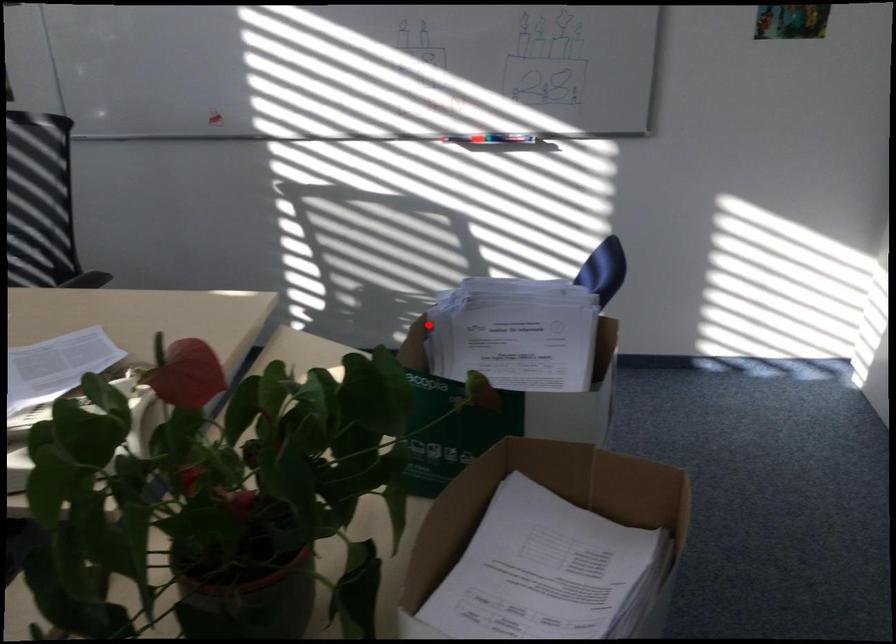
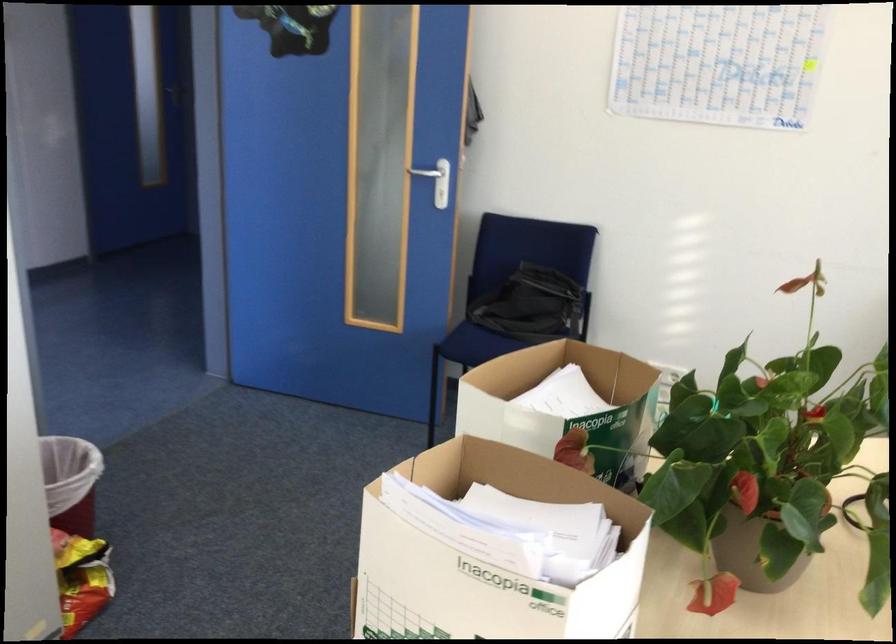
Question: I am providing you with two images of the same scene from different viewpoints. In image1, a red point is highlighted. Considering the same 3D point in image2, which of the following is correct?

Choices:
 (A) It is closer
 (B) It is farther

Answer: (A)